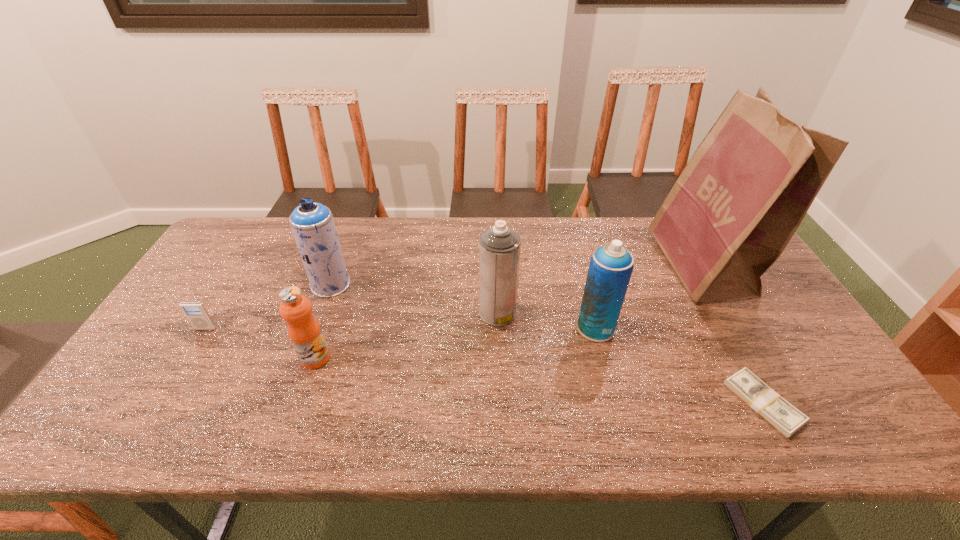
Select which object is the fifth closest to the iPod. Please provide its 2D coordinates. Your answer should be formatted as a tuple, i.e. [(x, y)], where the tuple contains the x and y coordinates of a point satisfying the conditions above.

[(746, 189)]

Locate an element on the screen. The image size is (960, 540). the closest object relative to the fifth tallest object is located at coordinates (313, 226).

Locate which aerosol can is the closest to the iPod. Please provide its 2D coordinates. Your answer should be formatted as a tuple, i.e. [(x, y)], where the tuple contains the x and y coordinates of a point satisfying the conditions above.

[(313, 226)]

This screenshot has height=540, width=960. Identify the location of aerosol can that is the nearest to the grocery bag. (610, 269).

Locate an element on the screen. Image resolution: width=960 pixels, height=540 pixels. vacant space that satisfies the following two spatial constraints: 1. on the front-facing side of the second shortest object; 2. on the left side of the third shortest object is located at coordinates pyautogui.click(x=187, y=359).

At what (x,y) coordinates should I click in order to perform the action: click on vacant region that satisfies the following two spatial constraints: 1. on the back side of the fruit juice; 2. on the left side of the fourth object from left to right. Please return your answer as a coordinate pair (x, y). Looking at the image, I should click on (331, 313).

At what (x,y) coordinates should I click in order to perform the action: click on free space that satisfies the following two spatial constraints: 1. on the front side of the nearest object; 2. on the left side of the farthest aerosol can. Please return your answer as a coordinate pair (x, y). The width and height of the screenshot is (960, 540). Looking at the image, I should click on [288, 402].